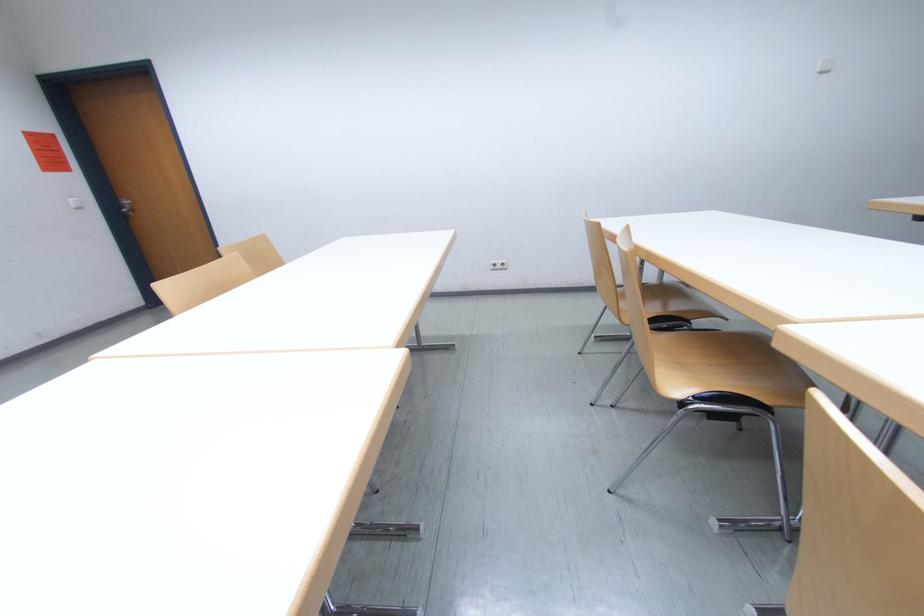
Find where to pull the metal door handle. Please return your answer as a coordinate pair (x, y).

(126, 207)